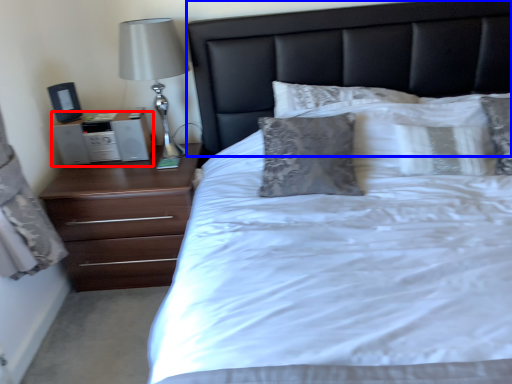
Question: Which object appears farthest to the camera in this image, nightstand (highlighted by a red box) or headboard (highlighted by a blue box)?

Choices:
 (A) nightstand
 (B) headboard

Answer: (A)